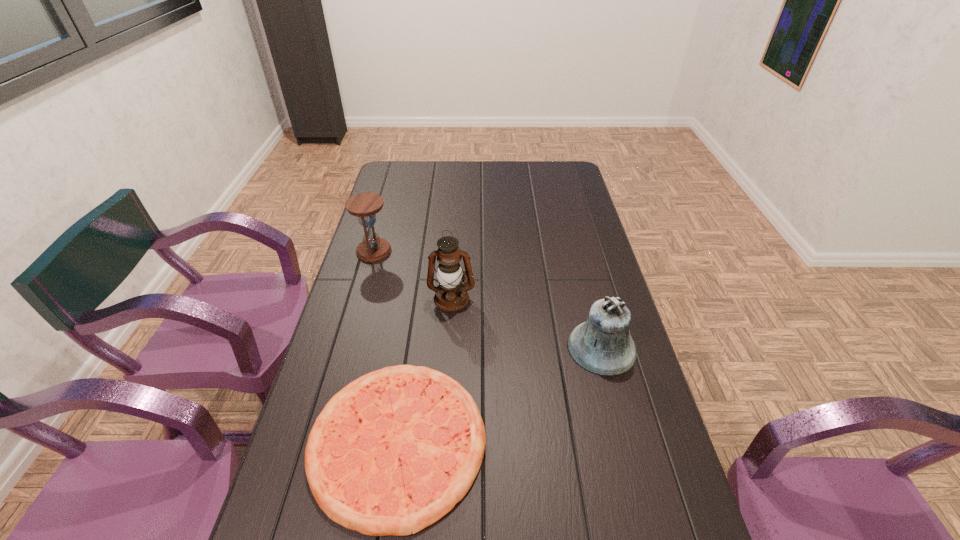
Identify the location of pizza that is positioned at the left edge. (361, 452).

The height and width of the screenshot is (540, 960). I want to click on object at the right edge, so click(x=602, y=345).

Identify the location of vacant space at the left edge of the desktop. This screenshot has width=960, height=540. (375, 263).

In the image, there is a desktop. At what (x,y) coordinates should I click in order to perform the action: click on vacant space at the right edge. Please return your answer as a coordinate pair (x, y). The height and width of the screenshot is (540, 960). Looking at the image, I should click on (637, 491).

This screenshot has width=960, height=540. Find the location of `vacant space at the far left corner of the desktop`. vacant space at the far left corner of the desktop is located at coordinates (421, 164).

Find the location of a particular element. Image resolution: width=960 pixels, height=540 pixels. free space at the far right corner of the desktop is located at coordinates (578, 182).

Where is `vacant space in between the third nearest object and the bell`? This screenshot has width=960, height=540. vacant space in between the third nearest object and the bell is located at coordinates (526, 323).

In order to click on vacant region between the tallest object and the rightmost object in this screenshot , I will do `click(526, 323)`.

The width and height of the screenshot is (960, 540). What are the coordinates of `vacant space that's between the pizza and the rightmost object` in the screenshot? It's located at (499, 394).

Find the location of a particular element. The height and width of the screenshot is (540, 960). free space between the farthest object and the bell is located at coordinates coord(488,300).